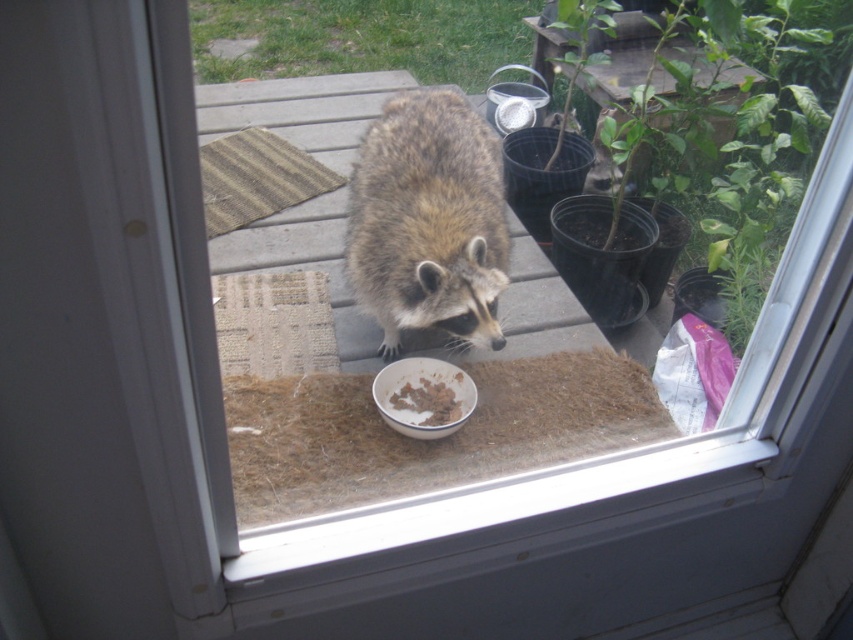
Is point (418, 241) less distant than point (431, 403)?

Yes, point (418, 241) is closer to viewer.

At what (x,y) coordinates should I click in order to perform the action: click on fuzzy brown raccoon at center. Please return your answer as a coordinate pair (x, y). Image resolution: width=853 pixels, height=640 pixels. Looking at the image, I should click on (428, 220).